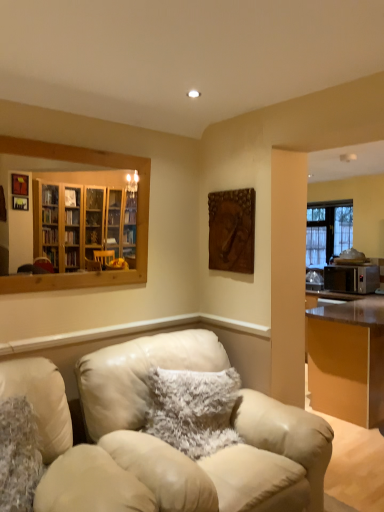
Question: Does fuzzy white pillow at center, marked as the 2th pillow in a front-to-back arrangement, lie in front of fuzzy fabric pillow at lower left, the 1th pillow in the left-to-right sequence?

Choices:
 (A) yes
 (B) no

Answer: (B)

Question: From a real-world perspective, is fuzzy white pillow at center, marked as the 2th pillow in a front-to-back arrangement, positioned under fuzzy fabric pillow at lower left, marked as the 1th pillow in a front-to-back arrangement, based on gravity?

Choices:
 (A) yes
 (B) no

Answer: (B)

Question: Could you tell me if fuzzy white pillow at center, placed as the 1th pillow when sorted from back to front, is turned towards fuzzy fabric pillow at lower left, the second pillow positioned from the right?

Choices:
 (A) no
 (B) yes

Answer: (A)

Question: Does fuzzy white pillow at center, placed as the 1th pillow when sorted from back to front, lie behind fuzzy fabric pillow at lower left, the second pillow positioned from the right?

Choices:
 (A) no
 (B) yes

Answer: (B)

Question: Is fuzzy white pillow at center, placed as the 1th pillow when sorted from back to front, facing away from fuzzy fabric pillow at lower left, marked as the 1th pillow in a front-to-back arrangement?

Choices:
 (A) no
 (B) yes

Answer: (A)

Question: Is leather couch at center to the left or to the right of leather chair at center in the image?

Choices:
 (A) right
 (B) left

Answer: (A)

Question: Is leather couch at center inside or outside of leather chair at center?

Choices:
 (A) inside
 (B) outside

Answer: (B)

Question: Is leather couch at center taller or shorter than leather chair at center?

Choices:
 (A) short
 (B) tall

Answer: (B)

Question: From a real-world perspective, relative to leather chair at center, is leather couch at center vertically above or below?

Choices:
 (A) above
 (B) below

Answer: (B)

Question: Considering the positions of fuzzy white pillow at center, which is counted as the second pillow, starting from the left, and metallic brown desk at right in the image, is fuzzy white pillow at center, which is counted as the second pillow, starting from the left, wider or thinner than metallic brown desk at right?

Choices:
 (A) thin
 (B) wide

Answer: (A)

Question: Is fuzzy white pillow at center, arranged as the 1th pillow when viewed from the right, in front of or behind metallic brown desk at right in the image?

Choices:
 (A) behind
 (B) front

Answer: (B)

Question: Choose the correct answer: Is fuzzy white pillow at center, which is counted as the second pillow, starting from the left, inside metallic brown desk at right or outside it?

Choices:
 (A) inside
 (B) outside

Answer: (B)

Question: Visually, is fuzzy white pillow at center, arranged as the 1th pillow when viewed from the right, positioned to the left or to the right of metallic brown desk at right?

Choices:
 (A) left
 (B) right

Answer: (A)

Question: From the image's perspective, relative to wooden frame mirror at upper left, is metallic brown desk at right above or below?

Choices:
 (A) above
 (B) below

Answer: (B)

Question: From a real-world perspective, relative to wooden frame mirror at upper left, is metallic brown desk at right vertically above or below?

Choices:
 (A) above
 (B) below

Answer: (B)